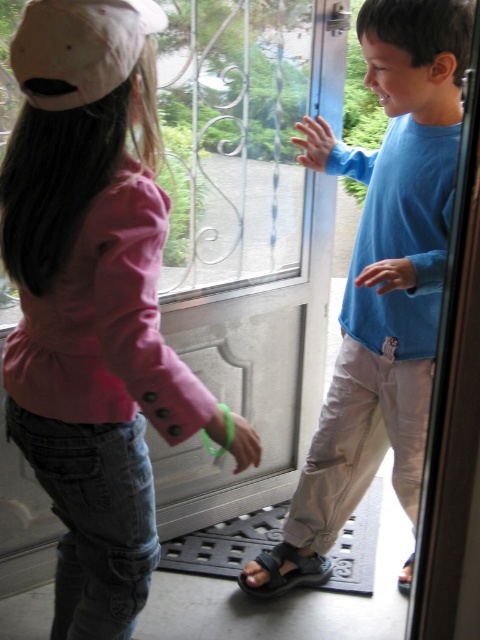
From the picture: You are a photographer trying to capture the perfect shot of the scene. You want to place your camera exactly at the midpoint between the pink fabric jacket at left and the glass door. What is the x and y coordinate of the midpoint?

The midpoint between the pink fabric jacket at left and the glass door would be at the average of their coordinates. Since the pink fabric jacket at left is at point (95, 301), and the glass door is presumably at the edge of the scene, we need to assume its coordinates. Assuming the glass door is at the right edge of the image, its coordinates might be around (240, 639). The midpoint would then be at x coordinate 0.7365 and y coordinate 0.349. However, without exact coordinates for the glass door, this is

You are a photographer trying to capture a clear photo of both the blue cotton shirt at center and the white matte baseball cap at upper left. Since you want to ensure both are visible, which object should you focus on first to account for their sizes?

The blue cotton shirt at center is bigger than the white matte baseball cap at upper left, so you should focus on the blue cotton shirt at center first as it takes up more space in the frame.

You are a photographer trying to capture a clear shot of both the pink fabric jacket at left and the white matte baseball cap at upper left. Since you want both subjects to be in focus, which one should you adjust your camera focus on first?

The pink fabric jacket at left is closer to you than the white matte baseball cap at upper left, so you should focus on the pink fabric jacket at left first to ensure both are in focus.